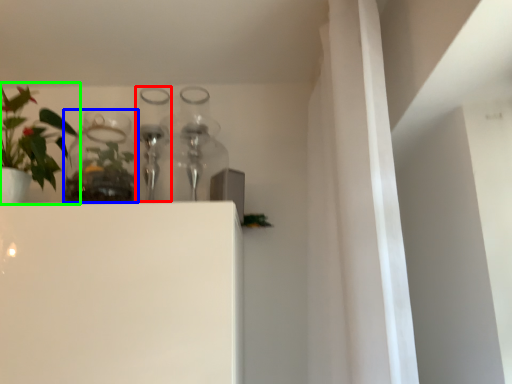
Question: Considering the real-world distances, which object is farthest from bottle (highlighted by a red box)? glass vase (highlighted by a blue box) or houseplant (highlighted by a green box)?

Choices:
 (A) glass vase
 (B) houseplant

Answer: (B)